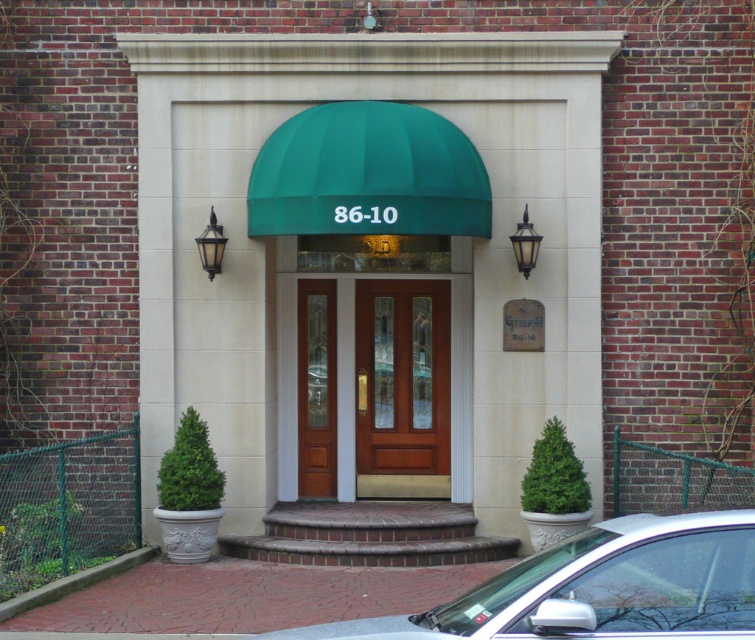
Between white glossy car at lower center and brown wood door at center, which one has less height?

Standing shorter between the two is white glossy car at lower center.

Who is higher up, white glossy car at lower center or brown wood door at center?

Positioned higher is brown wood door at center.

Find the location of a particular element. This screenshot has width=755, height=640. white glossy car at lower center is located at coordinates (596, 588).

Does mahogany wood door at center lie behind brown wood door at center?

No, it is in front of brown wood door at center.

Who is more distant from viewer, (418, 307) or (302, 480)?

Positioned behind is point (302, 480).

Where is `mahogany wood door at center`? mahogany wood door at center is located at coordinates (402, 388).

Describe the element at coordinates (596, 588) in the screenshot. I see `white glossy car at lower center` at that location.

Between white glossy car at lower center and mahogany wood door at center, which one has more height?

mahogany wood door at center is taller.

Is point (488, 625) in front of point (427, 464)?

Yes.

You are a GUI agent. You are given a task and a screenshot of the screen. Output one action in this format:
    pyautogui.click(x=<x>, y=<y>)
    Task: Click on the white glossy car at lower center
    The height and width of the screenshot is (640, 755).
    Given the screenshot: What is the action you would take?
    pyautogui.click(x=596, y=588)